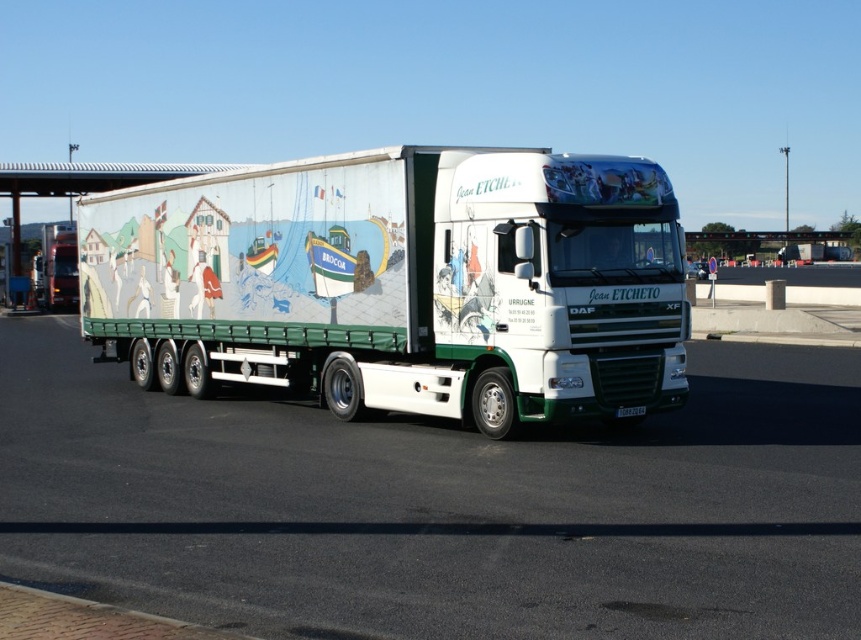
Question: Can you confirm if white asphalt highway at center is positioned above white glossy truck at center?

Choices:
 (A) no
 (B) yes

Answer: (A)

Question: Which point is closer to the camera taking this photo?

Choices:
 (A) (144, 282)
 (B) (567, 451)

Answer: (B)

Question: Which object is the closest to the white asphalt highway at center?

Choices:
 (A) white plastic license plate at center
 (B) gray concrete highway at center
 (C) white glossy truck at center

Answer: (C)

Question: Which point is farther from the camera taking this photo?

Choices:
 (A) (513, 410)
 (B) (641, 406)
 (C) (846, 458)
 (D) (767, 276)

Answer: (D)

Question: From the image, what is the correct spatial relationship of gray concrete highway at center in relation to white plastic license plate at center?

Choices:
 (A) below
 (B) above

Answer: (B)

Question: In this image, where is white glossy truck at center located relative to white plastic license plate at center?

Choices:
 (A) right
 (B) left

Answer: (B)